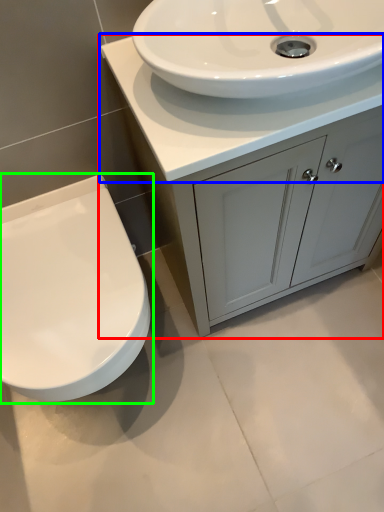
Question: Considering the real-world distances, which object is closest to bathroom cabinet (highlighted by a red box)? counter top (highlighted by a blue box) or toilet (highlighted by a green box).

Choices:
 (A) counter top
 (B) toilet

Answer: (A)